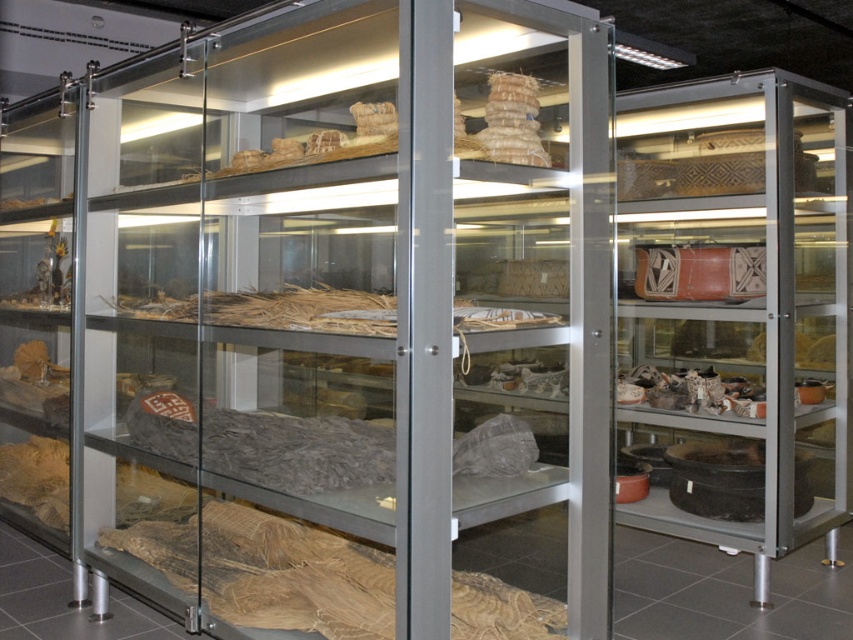
You are a museum visitor standing in front of the display case. You want to locate the matte ceramic bowls at right. Where exactly should you look within the display case?

You should look at the point with coordinates 0.487 on the x axis and 0.864 on the y axis within the display case to find the matte ceramic bowls at right.